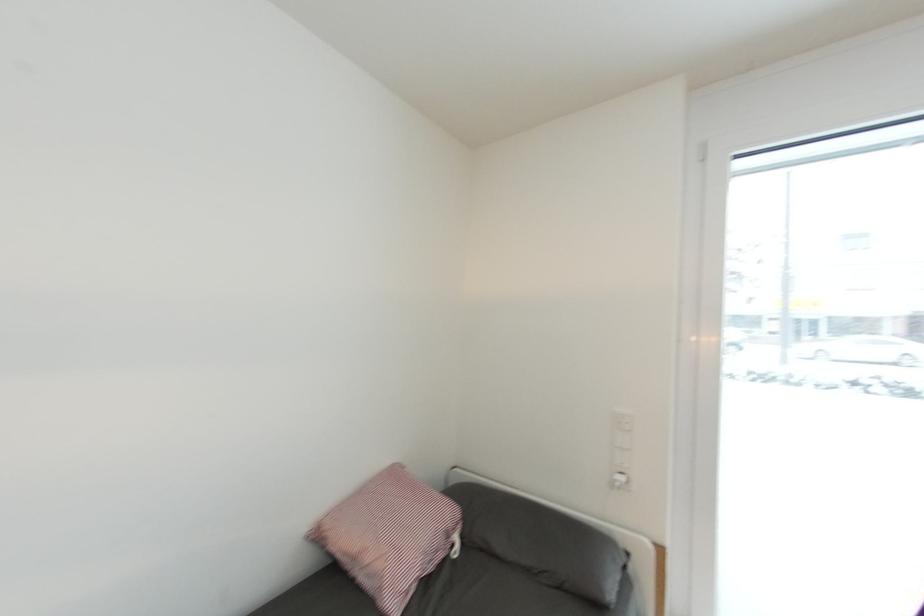
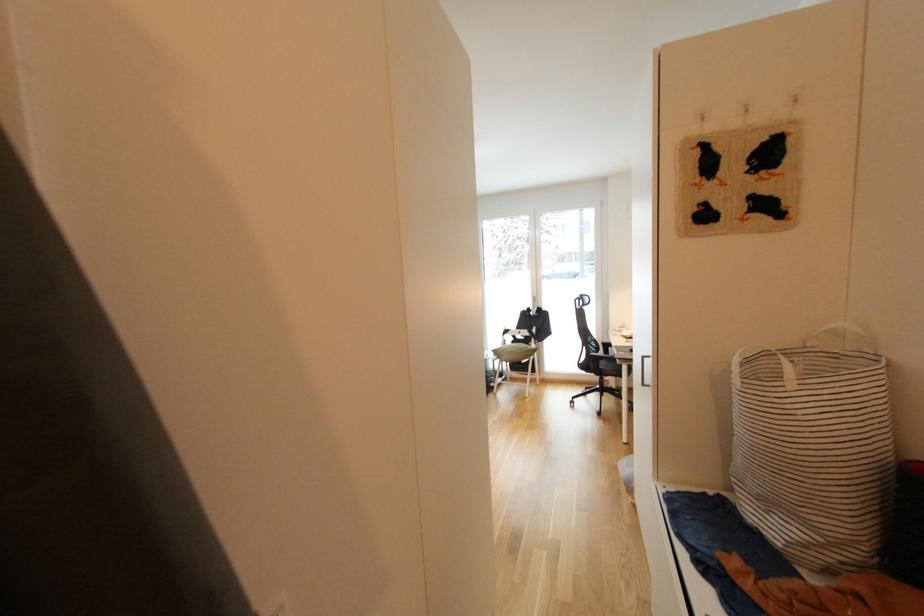
Question: The images are taken continuously from a first-person perspective. In which direction are you moving?

Choices:
 (A) Left
 (B) Right
 (C) Forward
 (D) Backward

Answer: (D)